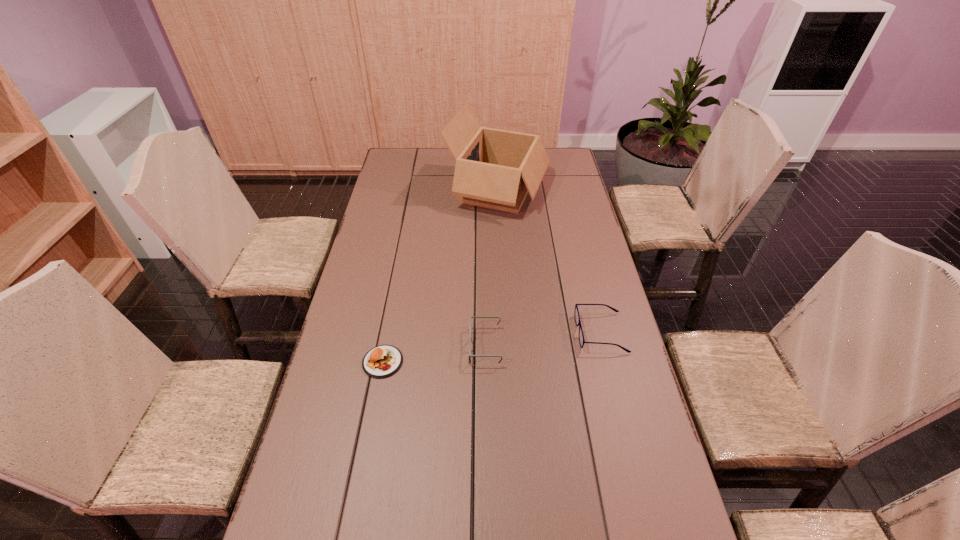
The image size is (960, 540). I want to click on free space between the tallest object and the right spectacles, so click(549, 261).

This screenshot has width=960, height=540. In order to click on object that is the third nearest to the left spectacles in this screenshot , I will do `click(496, 169)`.

Locate an element on the screen. object identified as the second closest to the shortest object is located at coordinates (576, 313).

At what (x,y) coordinates should I click in order to perform the action: click on blank area in the image that satisfies the following two spatial constraints: 1. on the front side of the farthest object; 2. on the lens of the left spectacles. Please return your answer as a coordinate pair (x, y). The width and height of the screenshot is (960, 540). Looking at the image, I should click on (506, 346).

Where is `vacant space that satisfies the following two spatial constraints: 1. on the back side of the farthest object; 2. on the right side of the patty (food)`? The width and height of the screenshot is (960, 540). vacant space that satisfies the following two spatial constraints: 1. on the back side of the farthest object; 2. on the right side of the patty (food) is located at coordinates (416, 189).